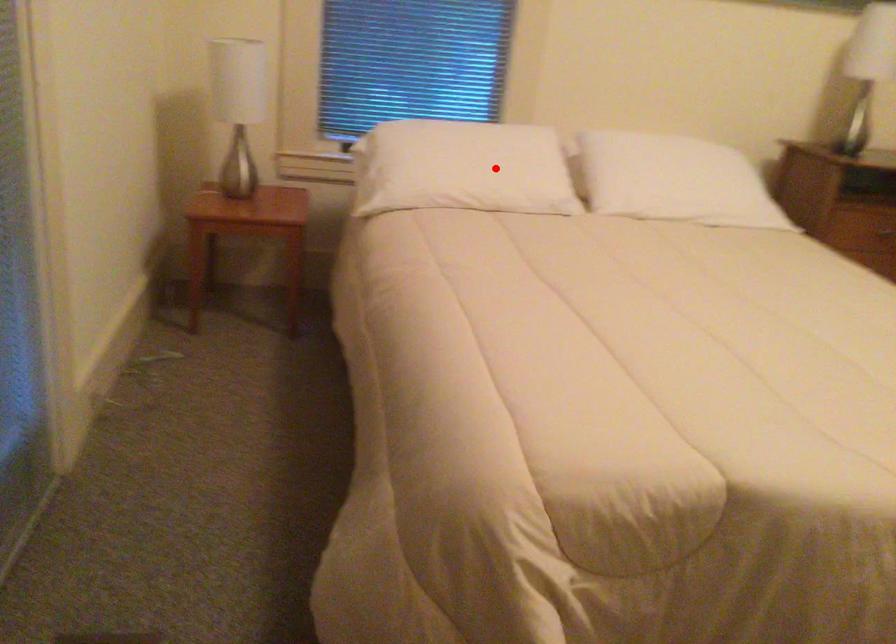
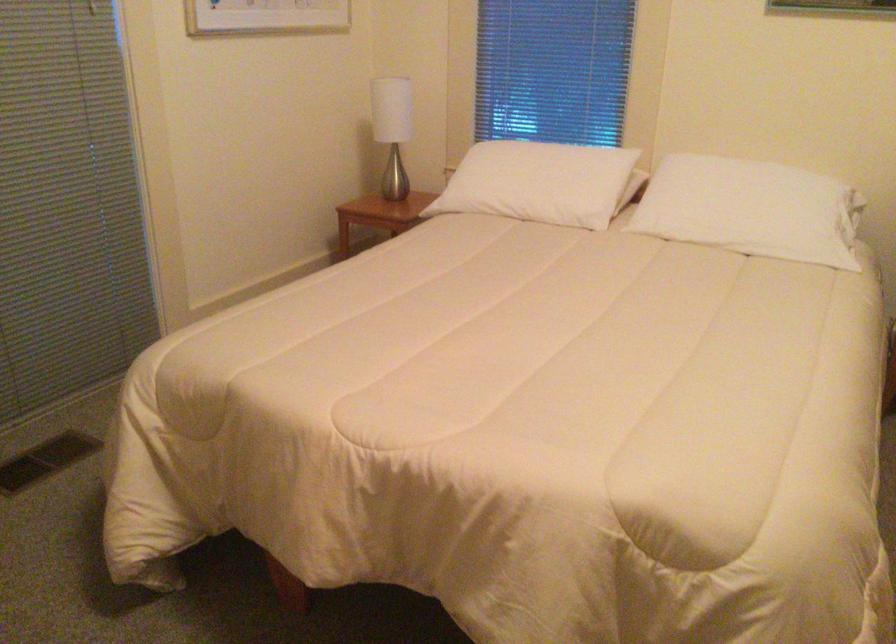
Question: I am providing you with two images of the same scene from different viewpoints. A red point is shown in image1. For the corresponding object point in image2, is it positioned nearer or farther from the camera?

Choices:
 (A) Nearer
 (B) Farther

Answer: (B)